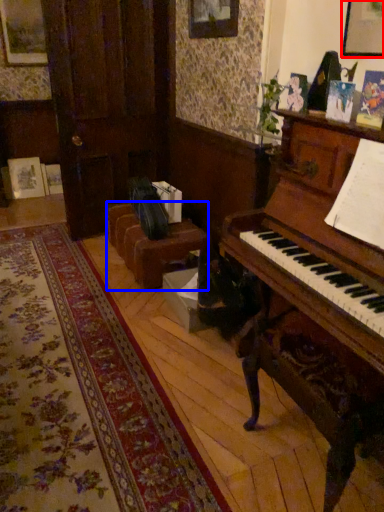
Question: Among these objects, which one is farthest to the camera, picture frame (highlighted by a red box) or furniture (highlighted by a blue box)?

Choices:
 (A) picture frame
 (B) furniture

Answer: (B)